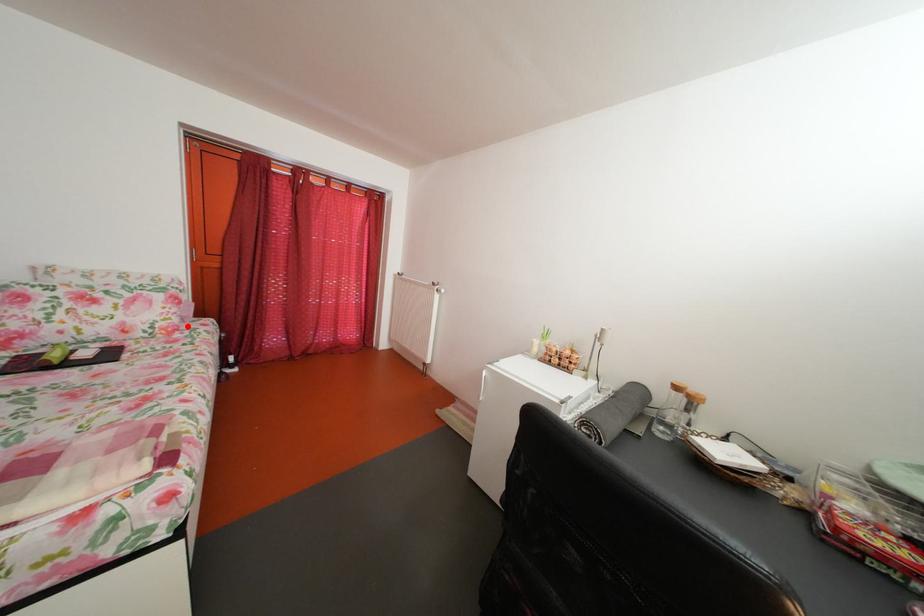
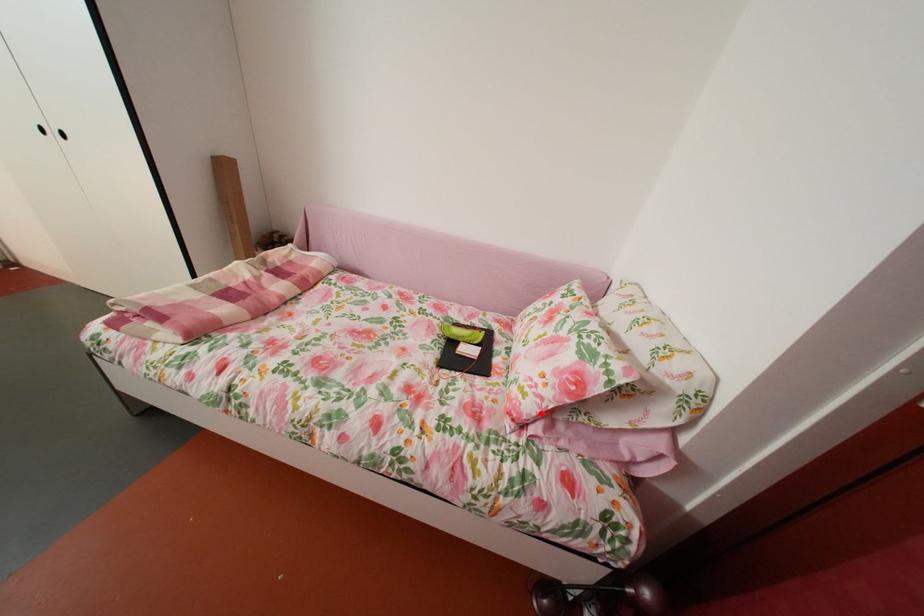
I am providing you with two images of the same scene from different viewpoints. A red point is marked on the first image and another point is marked on the second image. Is the marked point in image1 the same physical position as the marked point in image2?

Yes